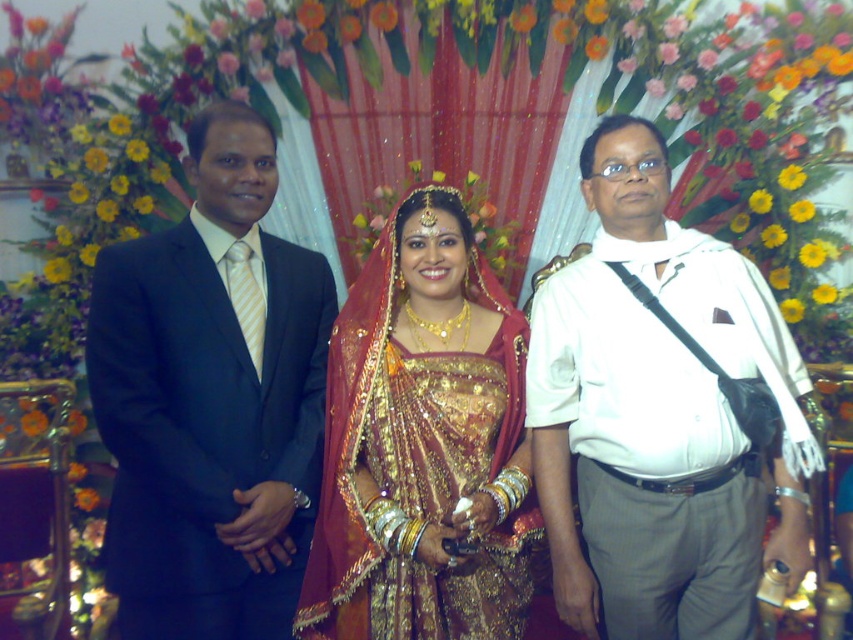
Question: Is gold sequined dress at center further to camera compared to white glossy shirt at right?

Choices:
 (A) yes
 (B) no

Answer: (A)

Question: Based on their relative distances, which object is nearer to the gold sequined dress at center?

Choices:
 (A) white glossy shirt at right
 (B) matte black suit at left

Answer: (A)

Question: Is gold sequined dress at center smaller than gold sequined saree at center?

Choices:
 (A) no
 (B) yes

Answer: (A)

Question: Which object is the closest to the gold sequined saree at center?

Choices:
 (A) white glossy shirt at right
 (B) gold sequined dress at center

Answer: (B)

Question: Which object is closer to the camera taking this photo?

Choices:
 (A) gold sequined dress at center
 (B) gold sequined saree at center
 (C) white glossy shirt at right

Answer: (C)

Question: Does gold sequined dress at center appear on the right side of white glossy shirt at right?

Choices:
 (A) yes
 (B) no

Answer: (B)